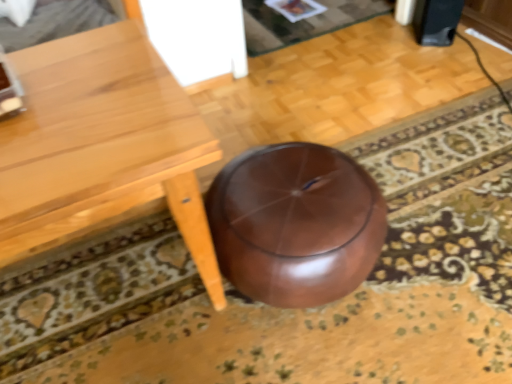
The image size is (512, 384). Find the location of `vacant space that is to the left of black matte speaker at upper right`. vacant space that is to the left of black matte speaker at upper right is located at coordinates click(x=394, y=39).